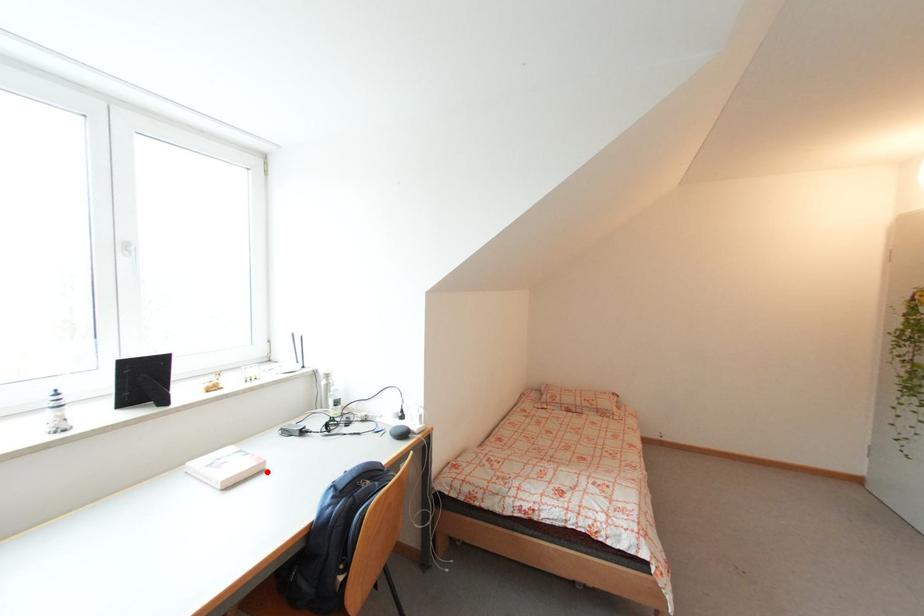
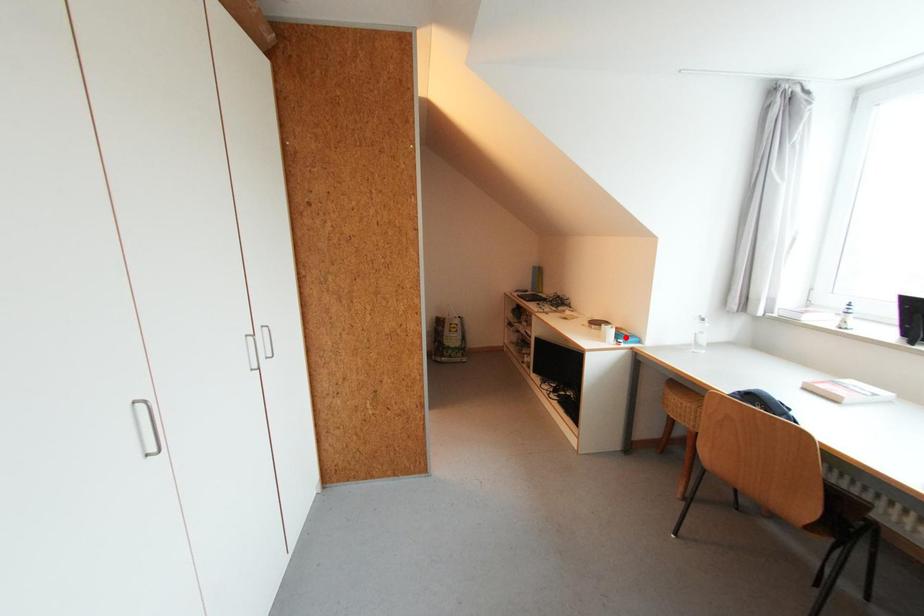
I am providing you with two images of the same scene from different viewpoints. A red point is marked on the first image and another point is marked on the second image. Is the red point in image1 aligned with the point shown in image2?

No